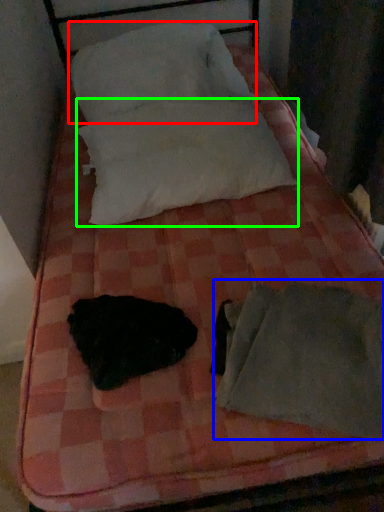
Question: Considering the real-world distances, which object is closest to pillow (highlighted by a red box)? sleeping bag (highlighted by a blue box) or pillow (highlighted by a green box).

Choices:
 (A) sleeping bag
 (B) pillow

Answer: (B)